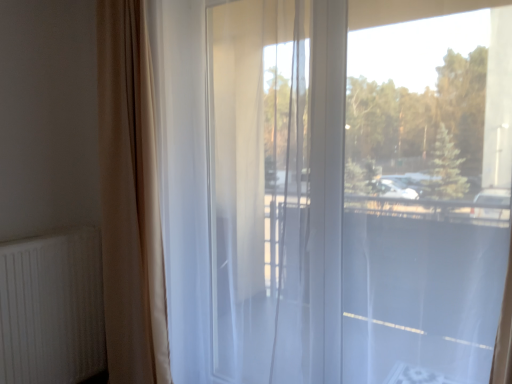
The height and width of the screenshot is (384, 512). I want to click on beige fabric curtain at left, so click(x=130, y=199).

The height and width of the screenshot is (384, 512). What are the coordinates of `white ribbed radiator at lower left` in the screenshot? It's located at (52, 309).

Find the location of a particular element. This screenshot has height=384, width=512. beige fabric curtain at left is located at coordinates (130, 199).

In the image, is transparent glass window at center positioned in front of or behind beige fabric curtain at left?

Visually, transparent glass window at center is located in front of beige fabric curtain at left.

From the picture: Is transparent glass window at center taller or shorter than beige fabric curtain at left?

In the image, transparent glass window at center appears to be shorter than beige fabric curtain at left.

In the scene shown: Who is bigger, transparent glass window at center or beige fabric curtain at left?

Bigger between the two is transparent glass window at center.

Is transparent glass window at center facing away from beige fabric curtain at left?

No, beige fabric curtain at left is not at the back of transparent glass window at center.

Is transparent glass window at center far away from white ribbed radiator at lower left?

Yes.

From the image's perspective, is transparent glass window at center above white ribbed radiator at lower left?

Yes.

Is transparent glass window at center taller or shorter than white ribbed radiator at lower left?

In the image, transparent glass window at center appears to be taller than white ribbed radiator at lower left.

What's the angular difference between transparent glass window at center and white ribbed radiator at lower left's facing directions?

89.5 degrees separate the facing orientations of transparent glass window at center and white ribbed radiator at lower left.

From a real-world perspective, is beige fabric curtain at left below transparent glass window at center?

Yes, from a real-world perspective, beige fabric curtain at left is under transparent glass window at center.

From the image's perspective, is beige fabric curtain at left above or below transparent glass window at center?

Clearly, from the image's perspective, beige fabric curtain at left is below transparent glass window at center.

From the picture: Is beige fabric curtain at left facing away from transparent glass window at center?

No, beige fabric curtain at left is not facing the opposite direction of transparent glass window at center.

Considering the sizes of objects beige fabric curtain at left and transparent glass window at center in the image provided, who is thinner, beige fabric curtain at left or transparent glass window at center?

With smaller width is transparent glass window at center.

In order to click on curtain located above the white ribbed radiator at lower left (from the image's perspective) in this screenshot , I will do `click(130, 199)`.

From the picture: Is beige fabric curtain at left next to white ribbed radiator at lower left?

No, beige fabric curtain at left is not touching white ribbed radiator at lower left.

Who is taller, beige fabric curtain at left or white ribbed radiator at lower left?

Standing taller between the two is beige fabric curtain at left.

Is beige fabric curtain at left positioned with its back to white ribbed radiator at lower left?

No, beige fabric curtain at left's orientation is not away from white ribbed radiator at lower left.

Between white ribbed radiator at lower left and transparent glass window at center, which one has smaller size?

With smaller size is white ribbed radiator at lower left.

From a real-world perspective, is white ribbed radiator at lower left under transparent glass window at center?

Yes, from a real-world perspective, white ribbed radiator at lower left is below transparent glass window at center.

You are a GUI agent. You are given a task and a screenshot of the screen. Output one action in this format:
    pyautogui.click(x=<x>, y=<y>)
    Task: Click on the window lying on the right of white ribbed radiator at lower left
    This screenshot has height=384, width=512.
    Given the screenshot: What is the action you would take?
    pyautogui.click(x=328, y=196)

Is white ribbed radiator at lower left wider than beige fabric curtain at left?

No.

Which is in front, point (63, 234) or point (150, 268)?

The point (150, 268) is closer.

From the image's perspective, is white ribbed radiator at lower left above or below beige fabric curtain at left?

Clearly, from the image's perspective, white ribbed radiator at lower left is below beige fabric curtain at left.

Can we say white ribbed radiator at lower left lies outside beige fabric curtain at left?

Yes, white ribbed radiator at lower left is not within beige fabric curtain at left.

The height and width of the screenshot is (384, 512). I want to click on curtain beneath the transparent glass window at center (from a real-world perspective), so click(130, 199).

At what (x,y) coordinates should I click in order to perform the action: click on window in front of the white ribbed radiator at lower left. Please return your answer as a coordinate pair (x, y). The height and width of the screenshot is (384, 512). Looking at the image, I should click on (328, 196).

From the image, which object appears to be nearer to white ribbed radiator at lower left, beige fabric curtain at left or transparent glass window at center?

Among the two, beige fabric curtain at left is located nearer to white ribbed radiator at lower left.

Based on their spatial positions, is white ribbed radiator at lower left or beige fabric curtain at left closer to transparent glass window at center?

beige fabric curtain at left lies closer to transparent glass window at center than the other object.

Considering their positions, is transparent glass window at center positioned closer to white ribbed radiator at lower left than beige fabric curtain at left?

Based on the image, beige fabric curtain at left appears to be nearer to white ribbed radiator at lower left.

Which object lies further to the anchor point beige fabric curtain at left, white ribbed radiator at lower left or transparent glass window at center?

transparent glass window at center is further to beige fabric curtain at left.

Estimate the real-world distances between objects in this image. Which object is further from transparent glass window at center, beige fabric curtain at left or white ribbed radiator at lower left?

white ribbed radiator at lower left is positioned further to the anchor transparent glass window at center.

When comparing their distances from beige fabric curtain at left, does transparent glass window at center or white ribbed radiator at lower left seem further?

transparent glass window at center lies further to beige fabric curtain at left than the other object.

In order to click on curtain between white ribbed radiator at lower left and transparent glass window at center in this screenshot , I will do `click(130, 199)`.